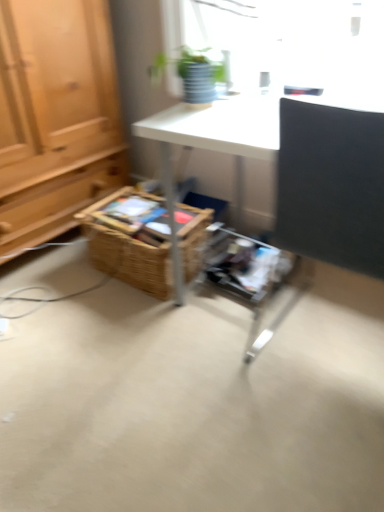
Question: Should I look upward or downward to see woven brown basket at center?

Choices:
 (A) up
 (B) down

Answer: (A)

Question: Considering the relative sizes of matte black desk at right and woven brown basket at center in the image provided, is matte black desk at right wider than woven brown basket at center?

Choices:
 (A) no
 (B) yes

Answer: (B)

Question: From a real-world perspective, does matte black desk at right stand above woven brown basket at center?

Choices:
 (A) yes
 (B) no

Answer: (A)

Question: Is woven brown basket at center completely or partially inside matte black desk at right?

Choices:
 (A) no
 (B) yes

Answer: (A)

Question: Considering the relative sizes of matte black desk at right and woven brown basket at center in the image provided, is matte black desk at right smaller than woven brown basket at center?

Choices:
 (A) yes
 (B) no

Answer: (B)

Question: Is the position of matte black desk at right more distant than that of woven brown basket at center?

Choices:
 (A) no
 (B) yes

Answer: (A)

Question: Is matte black desk at right taller than woven brown basket at center?

Choices:
 (A) yes
 (B) no

Answer: (A)

Question: Is green matte plant at upper center next to woven brown basket at center and touching it?

Choices:
 (A) yes
 (B) no

Answer: (B)

Question: From a real-world perspective, does green matte plant at upper center sit lower than woven brown basket at center?

Choices:
 (A) no
 (B) yes

Answer: (A)

Question: Does green matte plant at upper center turn towards woven brown basket at center?

Choices:
 (A) yes
 (B) no

Answer: (B)

Question: Can you confirm if green matte plant at upper center is wider than woven brown basket at center?

Choices:
 (A) yes
 (B) no

Answer: (B)

Question: From a real-world perspective, is green matte plant at upper center on woven brown basket at center?

Choices:
 (A) no
 (B) yes

Answer: (B)

Question: Considering the relative positions of green matte plant at upper center and woven brown basket at center in the image provided, is green matte plant at upper center to the right of woven brown basket at center from the viewer's perspective?

Choices:
 (A) no
 (B) yes

Answer: (B)

Question: Does woven brown basket at center have a lesser height compared to matte black desk at right?

Choices:
 (A) yes
 (B) no

Answer: (A)